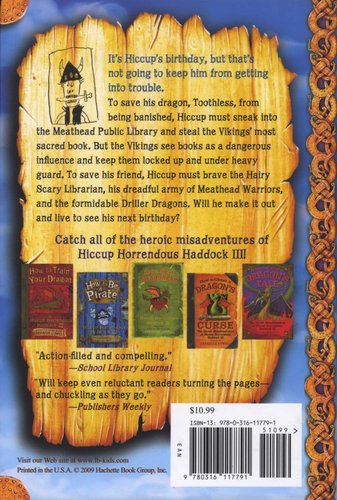
At what (x,y) coordinates should I click in order to perform the action: click on picture. Please return your answer as a coordinate pair (x, y). The height and width of the screenshot is (500, 337). Looking at the image, I should click on (250, 290), (221, 300), (170, 298), (102, 307), (54, 293).